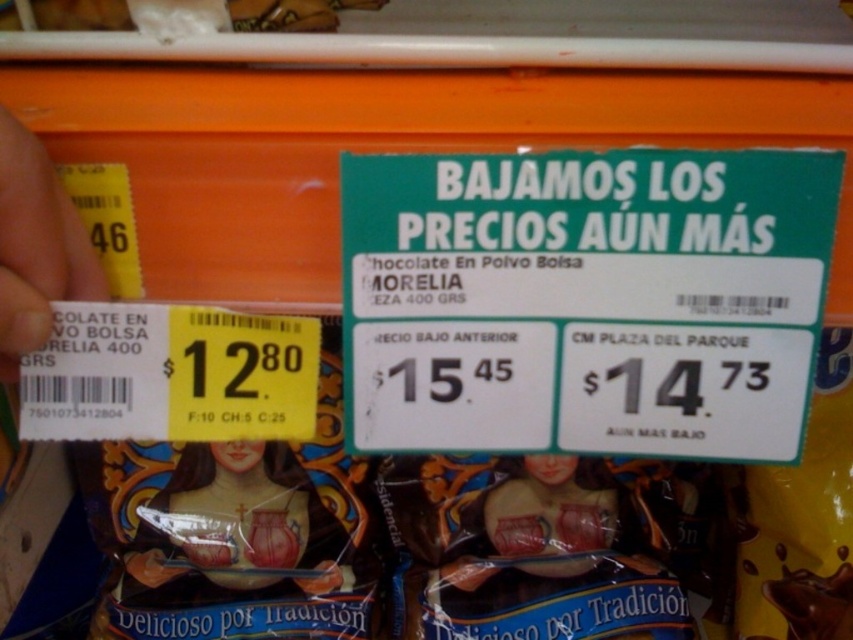
You are a cashier scanning items at a supermarket checkout. You have two points on the price tag display for the chocolate powder bag. The points are labeled as point (235,486) and point (538,477). Which point is closer to the cashier when looking at the price tag?

Point (235,486) is in front of point (538,477), so it is closer to the cashier when looking at the price tag.

You are a delivery person who needs to place a matte brown statue at center on a shelf that has a maximum height limit of 0.3 meters. Can you safely place the statue without exceeding the height limit?

The matte brown statue at center is located at point 0.292 in height, which is below the 0.3 meters limit. Therefore, you can safely place it without exceeding the height limit.